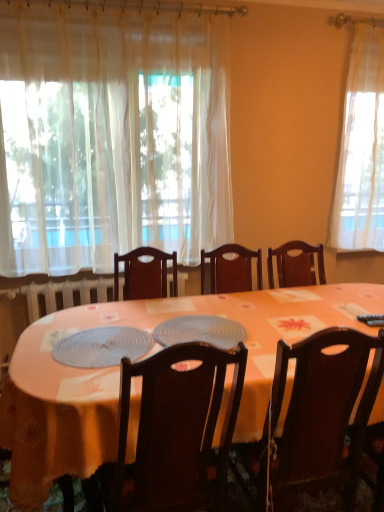
What are the coordinates of `free space to the back side of translucent plastic platter at center, which is the second platter from right to left` in the screenshot? It's located at (124, 314).